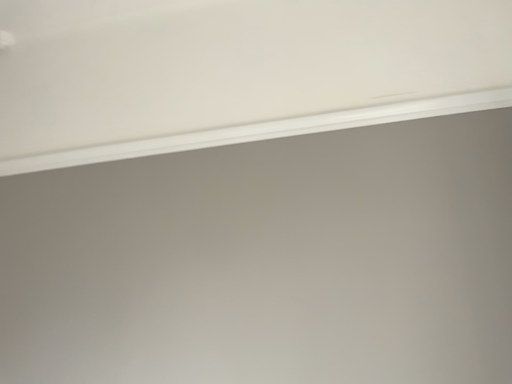
Describe the element at coordinates (234, 71) in the screenshot. I see `white smooth bathtub at upper center` at that location.

Where is `white smooth bathtub at upper center`? The image size is (512, 384). white smooth bathtub at upper center is located at coordinates (234, 71).

Identify the location of white smooth bathtub at upper center. The width and height of the screenshot is (512, 384). (234, 71).